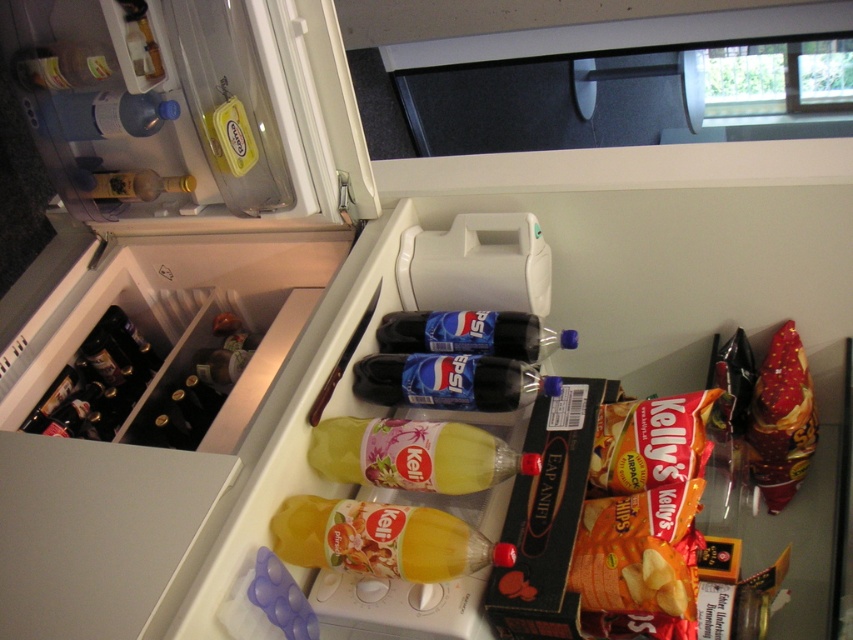
Question: Based on their relative distances, which object is farther from the matte plastic bottle at upper left?

Choices:
 (A) translucent yellow bottle at center
 (B) translucent plastic bottle at upper left
 (C) dark brown glass bottles at lower left
 (D) translucent plastic bottle at lower left

Answer: (A)

Question: Does translucent yellow bottle at center come behind dark brown glass bottles at lower left?

Choices:
 (A) yes
 (B) no

Answer: (B)

Question: Estimate the real-world distances between objects in this image. Which object is farther from the glossy plastic pepsi bottle at center?

Choices:
 (A) matte yellow bottle at upper left
 (B) dark brown glass bottles at lower left
 (C) orange matte snack packet at lower right

Answer: (B)

Question: Is translucent yellow bottle at center thinner than dark brown glass bottles at lower left?

Choices:
 (A) no
 (B) yes

Answer: (A)

Question: Which is nearer to the blue plastic pepsi bottle at center?

Choices:
 (A) orange matte kelly's chips at right
 (B) translucent plastic bottle at lower left

Answer: (A)

Question: Is the position of orange matte snack packet at lower right more distant than that of blue plastic pepsi bottle at center?

Choices:
 (A) no
 (B) yes

Answer: (A)